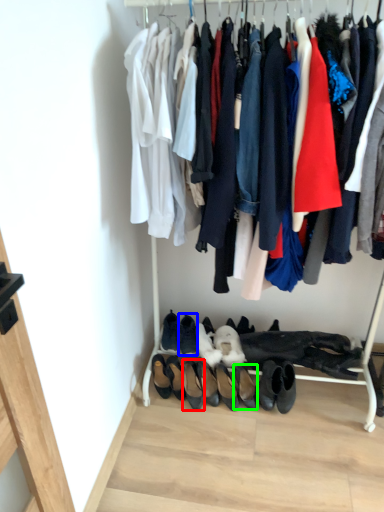
Question: Based on their relative distances, which object is farther from footwear (highlighted by a red box)? Choose from footwear (highlighted by a blue box) and footwear (highlighted by a green box).

Choices:
 (A) footwear
 (B) footwear

Answer: (B)